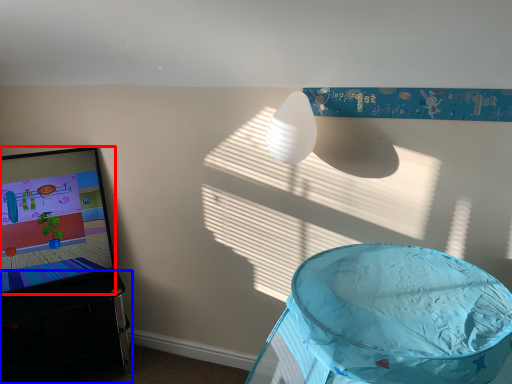
Question: Which of the following is the farthest to the observer, computer screen (highlighted by a red box) or furniture (highlighted by a blue box)?

Choices:
 (A) computer screen
 (B) furniture

Answer: (A)